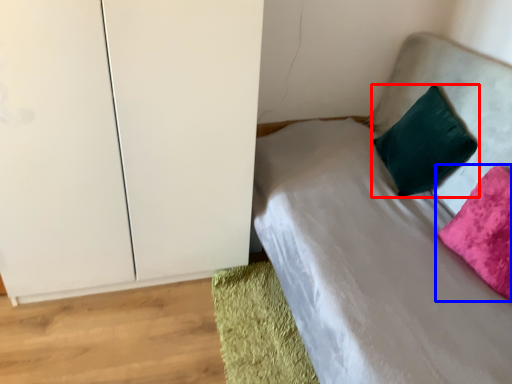
Question: Which of the following is the closest to the observer, pillow (highlighted by a red box) or pillow (highlighted by a blue box)?

Choices:
 (A) pillow
 (B) pillow

Answer: (B)